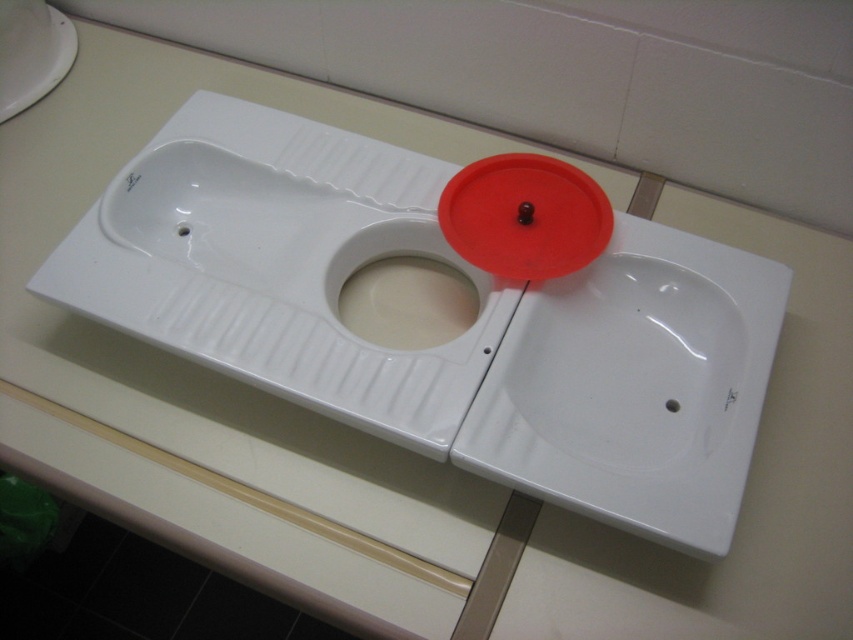
From the picture: You are standing in front of the urinal and need to reach both the white glossy sink at center and the red matte lid at center. Which object is easier to reach without moving your position?

The white glossy sink at center is closer to the viewer than the red matte lid at center, so it is easier to reach without moving your position.

You are a maintenance worker checking the bathroom fixtures. You notice the white glossy sink at center and the red matte lid at center. Which object is located below the other?

The white glossy sink at center is positioned under the red matte lid at center, so the sink is below the lid.

You are a plumber inspecting a bathroom and need to install a new faucet. The faucet you have is exactly the same size as the red matte lid at center. Will the faucet fit in the white glossy sink at center?

The white glossy sink at center is bigger than the red matte lid at center, so the faucet, which is the same size as the red matte lid at center, will fit in the white glossy sink at center.